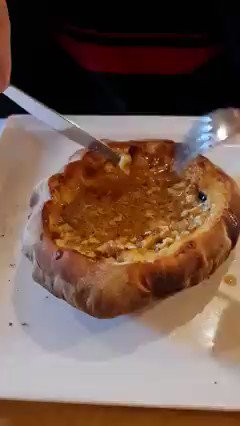
Find the location of a particular element. fork is located at coordinates (223, 129).